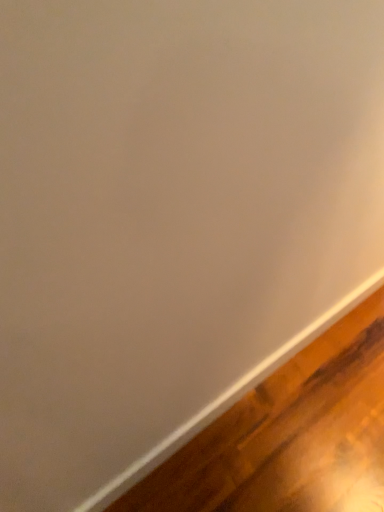
Question: Should I look upward or downward to see wooden floor at bottom right?

Choices:
 (A) up
 (B) down

Answer: (B)